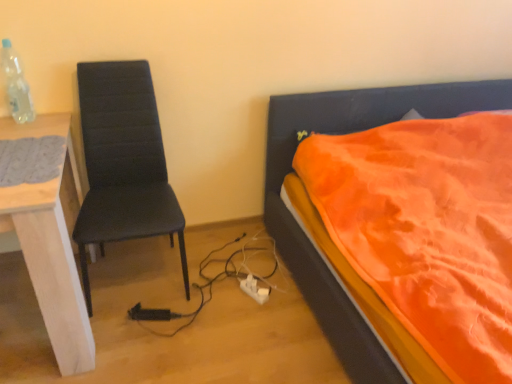
Find the location of `vacant space in front of matte black chair at left`. vacant space in front of matte black chair at left is located at coordinates (156, 348).